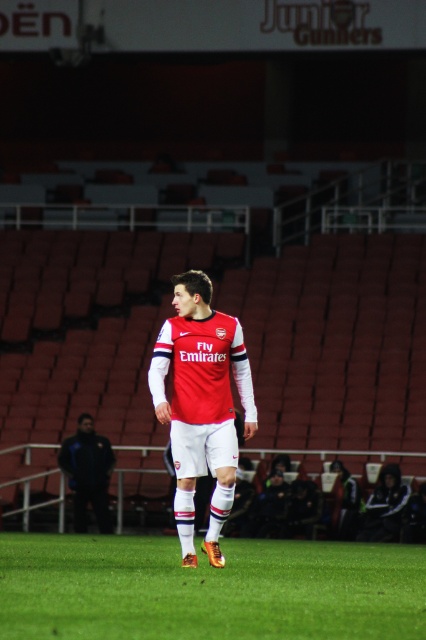
Question: Which of the following is the closest to the observer?

Choices:
 (A) coord(348,618)
 (B) coord(216,342)

Answer: (A)

Question: Which point is closer to the camera taking this photo?

Choices:
 (A) (394, 627)
 (B) (85, 509)
 (C) (187, 488)

Answer: (A)

Question: Is matte red jersey at center above dark blue jacket at lower left?

Choices:
 (A) yes
 (B) no

Answer: (A)

Question: Which point is farther to the camera?

Choices:
 (A) matte red jersey at center
 (B) green grass at center
 (C) dark blue jacket at lower left

Answer: (C)

Question: Does matte red jersey at center have a larger size compared to dark blue jacket at lower left?

Choices:
 (A) yes
 (B) no

Answer: (A)

Question: Does green grass at center appear on the left side of dark blue jacket at lower left?

Choices:
 (A) no
 (B) yes

Answer: (A)